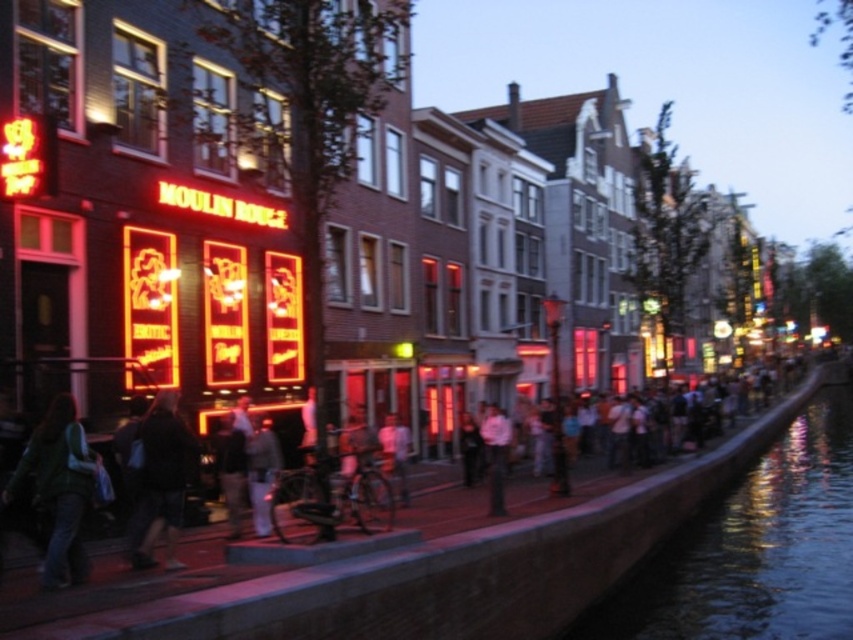
You are a photographer standing on a bridge overlooking the canal. You want to capture a photo where the dark blue liquid at lower right and the dark gray jacket at center are both visible. Which object should you focus on to ensure both are in the frame without cropping?

The dark blue liquid at lower right has a larger width than the dark gray jacket at center. To ensure both are in the frame, focus on the wider object, which is the dark blue liquid at lower right, as it requires more space in the composition.

Based on the photo, you are a tourist in Amsterdam and see the dark blue liquid at lower right and the dark gray jacket at center. Which object is located to the right side of the other?

The dark blue liquid at lower right is to the right of the dark gray jacket at center.